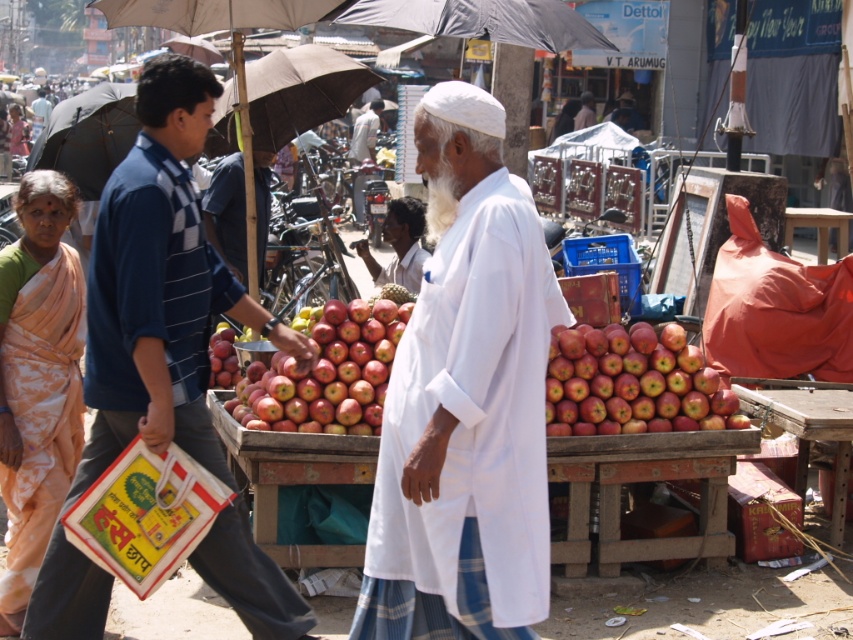
In the scene shown: You are standing at the entrance of the market and want to find the white cotton robe at center. According to the coordinates provided, in which direction should you look to locate it?

The white cotton robe at center is located at coordinates point (465, 401). Since the coordinate system is normalized, the x value 0.627 indicates a position to the right of the center, and the y value 0.546 indicates a position slightly below the center. Therefore, you should look to the right and slightly downward from the center to locate the white cotton robe at center.

Looking at this image, you are a photographer trying to capture both the white cotton robe at center and the white cotton shirt at center in a single frame. Based on their positions, which one should you adjust your camera angle to focus on first to ensure both are in the shot?

The white cotton robe at center is to the right of the white cotton shirt at center, so you should focus on the white cotton shirt at center first to ensure both are included in the frame.